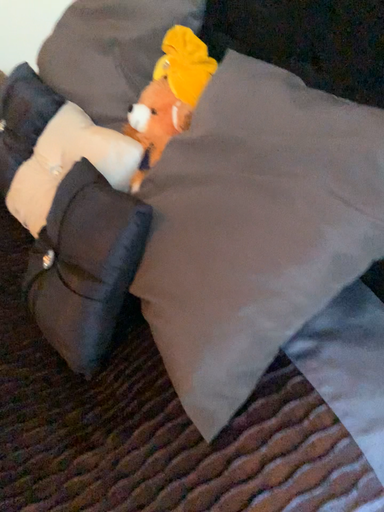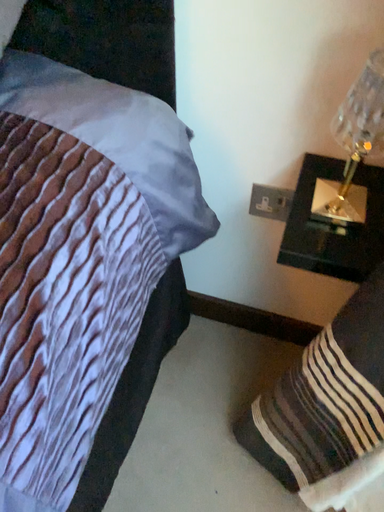
Question: Which way did the camera rotate in the video?

Choices:
 (A) rotated right
 (B) rotated left

Answer: (A)